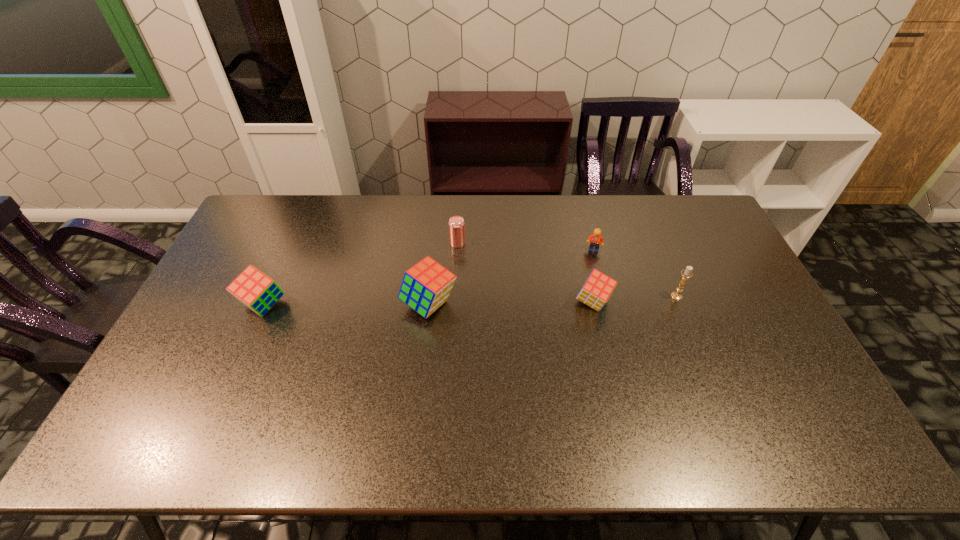
I want to click on the leftmost object, so click(x=254, y=289).

Locate an element on the screen. This screenshot has height=540, width=960. the leftmost cube is located at coordinates (254, 289).

The width and height of the screenshot is (960, 540). Find the location of `the second cube from right to left`. the second cube from right to left is located at coordinates (426, 286).

Identify the location of the rightmost cube. (597, 289).

This screenshot has width=960, height=540. I want to click on Lego, so click(596, 238).

Locate an element on the screen. beer can is located at coordinates (456, 223).

Locate an element on the screen. This screenshot has width=960, height=540. the rightmost object is located at coordinates (687, 273).

Locate an element on the screen. free space located on the front of the leftmost object is located at coordinates (240, 360).

Locate an element on the screen. The image size is (960, 540). vacant region located 0.390m on the right of the second cube from left to right is located at coordinates (587, 304).

In order to click on vacant region located 0.070m on the right of the shortest cube in this screenshot , I will do `click(635, 302)`.